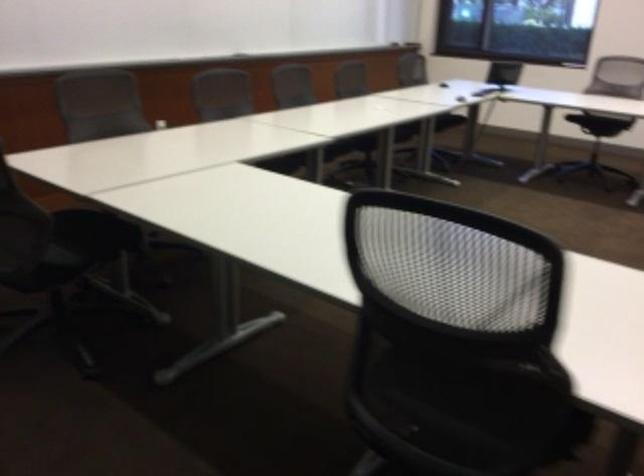
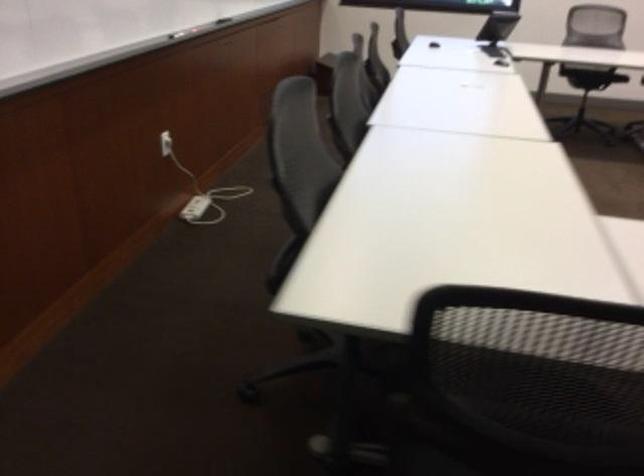
What movement of the cameraman would produce the second image?

The cameraman moved toward left, forward.